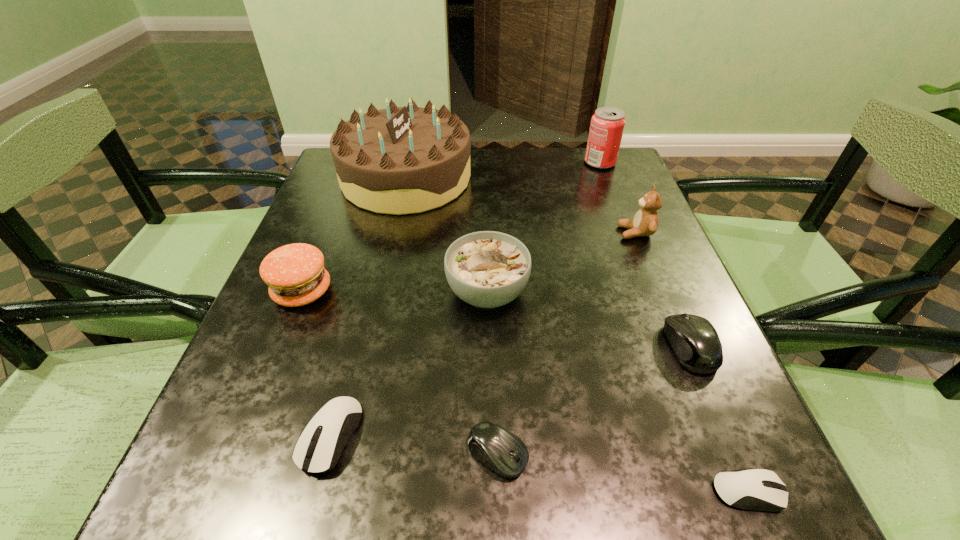
Where is `vacant space that's between the smaller black mouse and the smaller white mouse`? The width and height of the screenshot is (960, 540). vacant space that's between the smaller black mouse and the smaller white mouse is located at coordinates (623, 472).

This screenshot has height=540, width=960. What are the coordinates of `object that is the second closest to the bigger white mouse` in the screenshot? It's located at (295, 274).

Locate which object is the third closest to the brown birthday cake. Please provide its 2D coordinates. Your answer should be formatted as a tuple, i.e. [(x, y)], where the tuple contains the x and y coordinates of a point satisfying the conditions above.

[(607, 125)]

Locate an element on the screen. This screenshot has width=960, height=540. mouse that is the nearest to the birthday cake is located at coordinates (694, 340).

At what (x,y) coordinates should I click in order to perform the action: click on the second closest mouse relative to the third mouse from right to left. Please return your answer as a coordinate pair (x, y). Looking at the image, I should click on (760, 489).

This screenshot has width=960, height=540. What are the coordinates of `vacant region that satisfies the following two spatial constraints: 1. on the front-facing side of the third tallest object; 2. on the front side of the leftmost mouse` in the screenshot? It's located at (718, 436).

Where is `free point that satisfies the following two spatial constraints: 1. on the back side of the soda can; 2. on the right side of the third mouse from right to left`? The height and width of the screenshot is (540, 960). free point that satisfies the following two spatial constraints: 1. on the back side of the soda can; 2. on the right side of the third mouse from right to left is located at coordinates [490, 163].

Find the location of `free space that satisfies the following two spatial constraints: 1. on the back side of the second tallest object; 2. on the left side of the leftmost mouse`. free space that satisfies the following two spatial constraints: 1. on the back side of the second tallest object; 2. on the left side of the leftmost mouse is located at coordinates (400, 163).